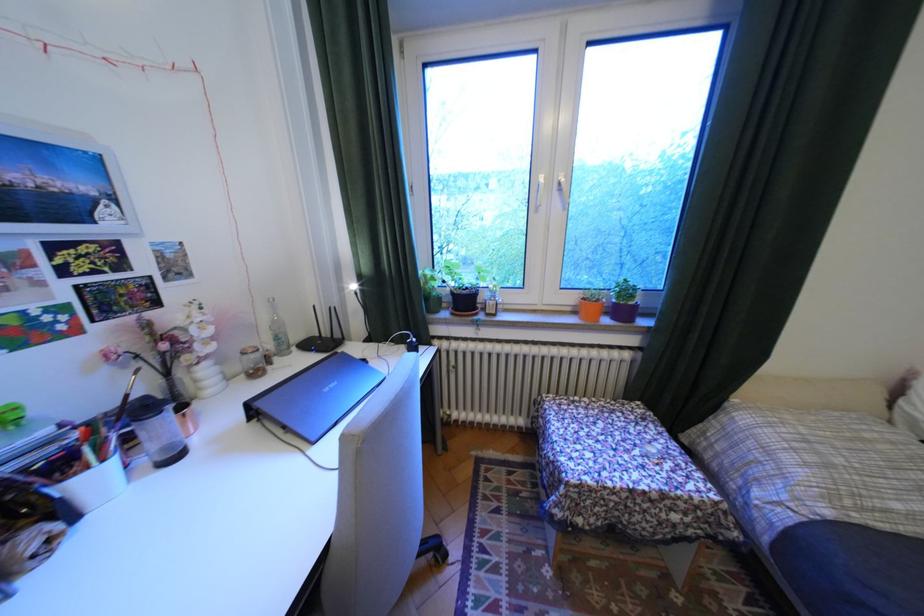
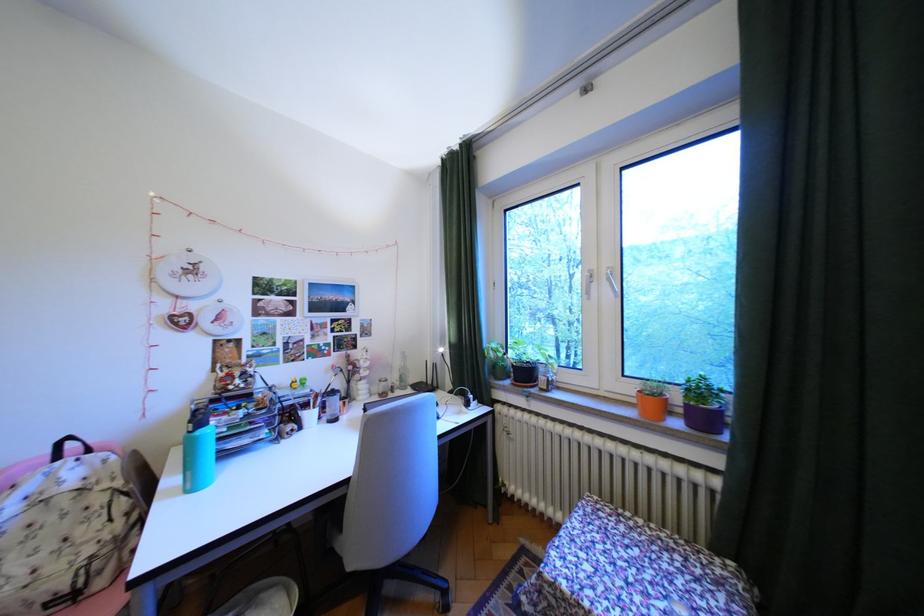
In the second image, find the point that corresponds to pixel 77 466 in the first image.

(318, 406)